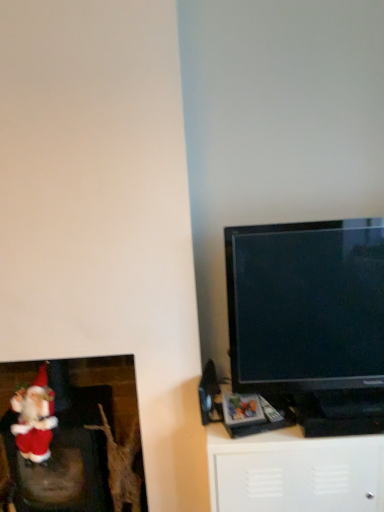
Question: Can you confirm if red plush santa at lower left is shorter than fuzzy fabric santa at lower left?

Choices:
 (A) no
 (B) yes

Answer: (A)

Question: Is red plush santa at lower left bigger than fuzzy fabric santa at lower left?

Choices:
 (A) yes
 (B) no

Answer: (A)

Question: Is red plush santa at lower left looking in the opposite direction of fuzzy fabric santa at lower left?

Choices:
 (A) no
 (B) yes

Answer: (B)

Question: Is the depth of red plush santa at lower left greater than that of fuzzy fabric santa at lower left?

Choices:
 (A) yes
 (B) no

Answer: (A)

Question: From a real-world perspective, is red plush santa at lower left located higher than fuzzy fabric santa at lower left?

Choices:
 (A) no
 (B) yes

Answer: (A)

Question: From the image's perspective, is red plush santa at lower left located beneath fuzzy fabric santa at lower left?

Choices:
 (A) no
 (B) yes

Answer: (B)

Question: Is red plush santa at lower left a part of black glossy tv at right?

Choices:
 (A) yes
 (B) no

Answer: (B)

Question: Is black glossy tv at right wider than red plush santa at lower left?

Choices:
 (A) yes
 (B) no

Answer: (B)

Question: Is black glossy tv at right facing away from red plush santa at lower left?

Choices:
 (A) no
 (B) yes

Answer: (A)

Question: Is the surface of black glossy tv at right in direct contact with red plush santa at lower left?

Choices:
 (A) no
 (B) yes

Answer: (A)

Question: Could you tell me if black glossy tv at right is turned towards red plush santa at lower left?

Choices:
 (A) no
 (B) yes

Answer: (A)

Question: Does black glossy tv at right lie in front of red plush santa at lower left?

Choices:
 (A) no
 (B) yes

Answer: (B)

Question: Does white matte cabinet at lower right have a lesser width compared to black glossy tv at right?

Choices:
 (A) no
 (B) yes

Answer: (A)